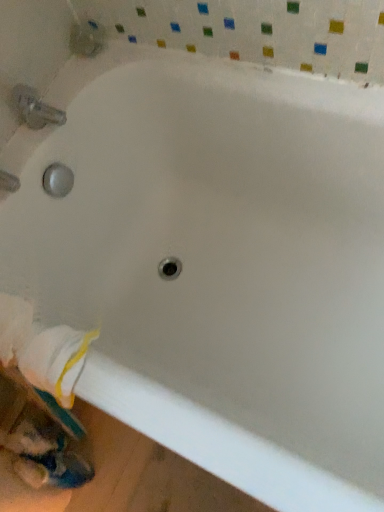
Where is `unoccupied region to the right of matte silver faucet at upper left`? unoccupied region to the right of matte silver faucet at upper left is located at coordinates (97, 74).